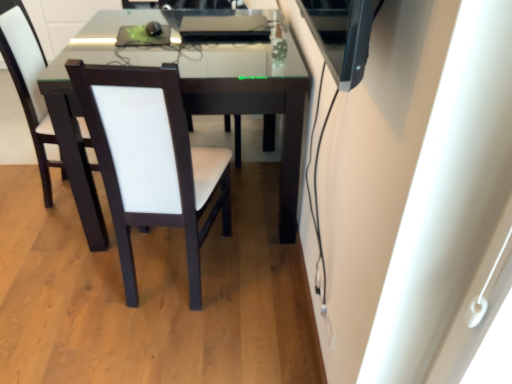
What are the coordinates of `free area in between white leather chair at center, which ranks as the 2th chair in right-to-left order, and white leather chair at center, the 1th chair from the right` in the screenshot? It's located at (202, 264).